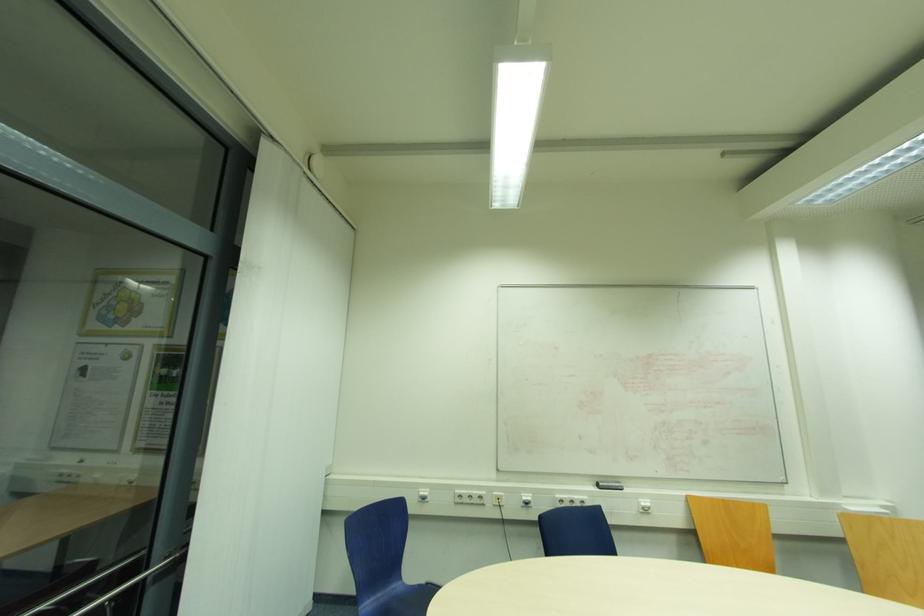
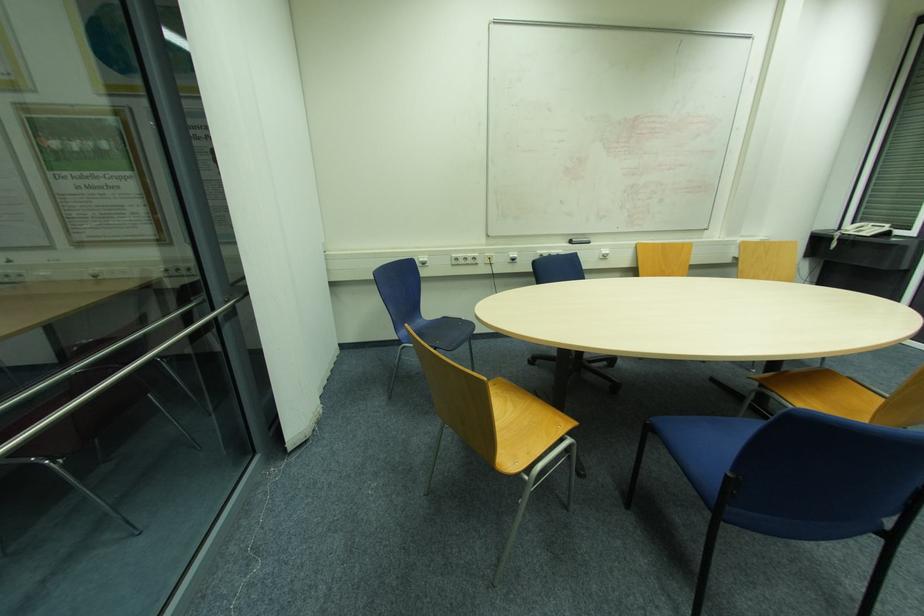
Locate, in the second image, the point that corresponds to (424,581) in the first image.

(440, 317)